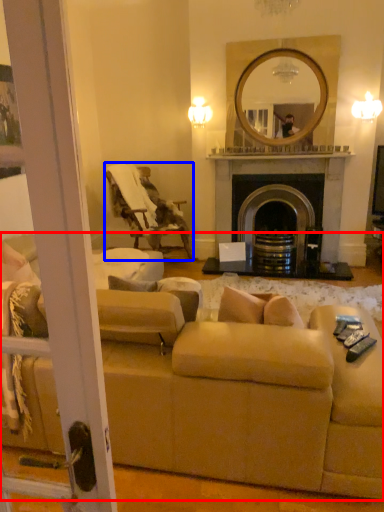
Question: Which of the following is the closest to the observer, studio couch (highlighted by a red box) or chair (highlighted by a blue box)?

Choices:
 (A) studio couch
 (B) chair

Answer: (A)